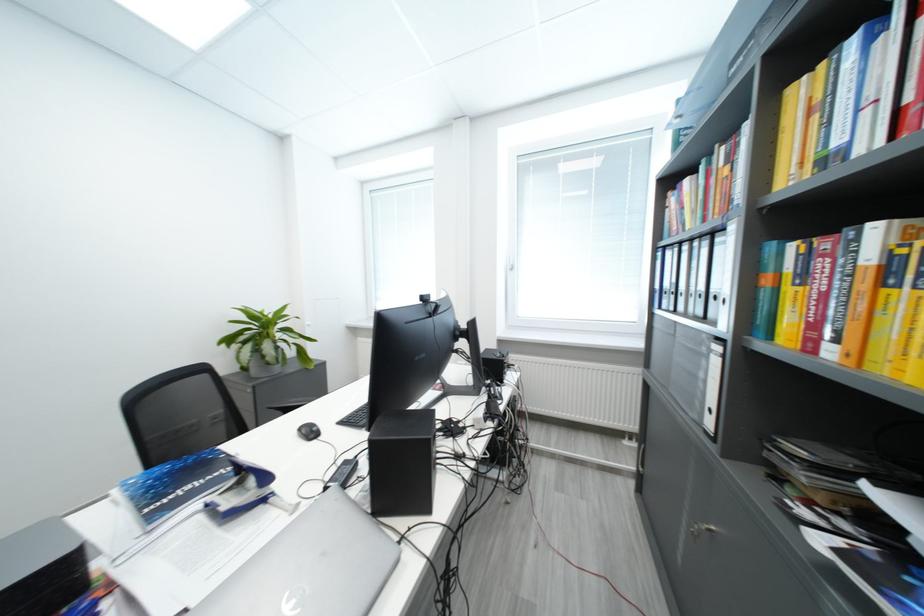
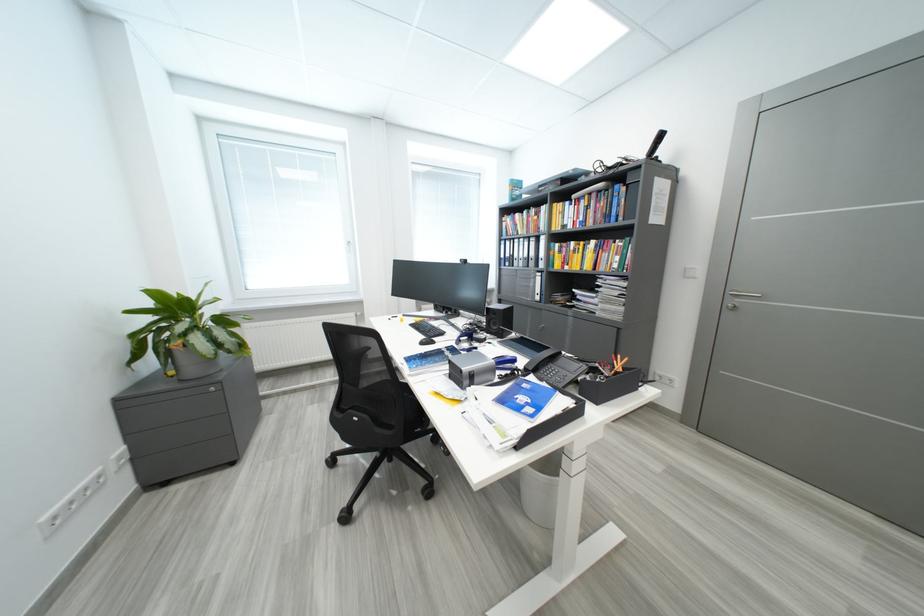
In the second image, find the point that corresponds to (x=251, y=341) in the first image.

(189, 331)